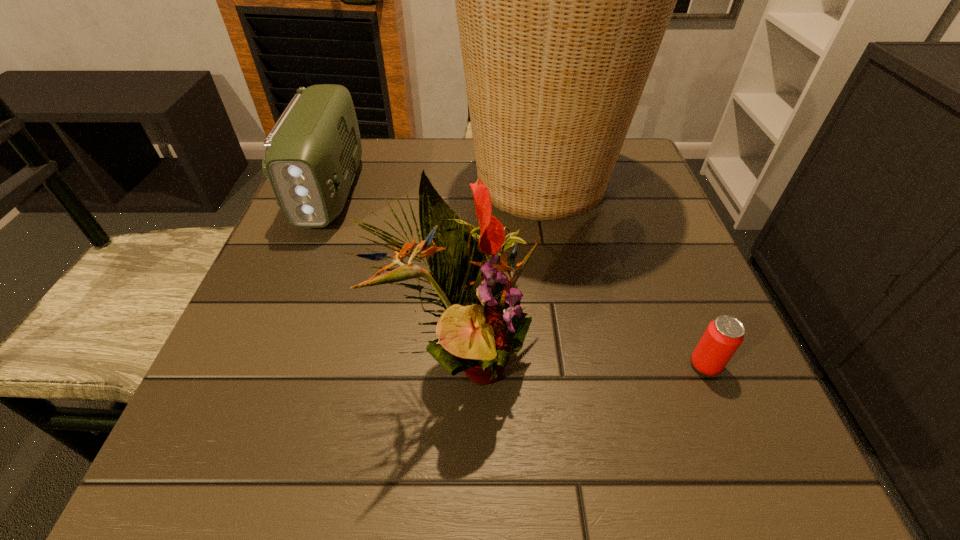
Where is `radio_receiver that is at the far edge`? The height and width of the screenshot is (540, 960). radio_receiver that is at the far edge is located at coordinates (313, 151).

This screenshot has width=960, height=540. I want to click on object that is at the near edge, so click(x=483, y=323).

Find the location of a particular element. The image size is (960, 540). object present at the left edge is located at coordinates (313, 151).

You are a GUI agent. You are given a task and a screenshot of the screen. Output one action in this format:
    pyautogui.click(x=<x>, y=<y>)
    Task: Click on the basket that is at the right edge
    The image size is (960, 540).
    Given the screenshot: What is the action you would take?
    pyautogui.click(x=562, y=0)

Identify the location of beer can that is at the right edge. The height and width of the screenshot is (540, 960). (723, 336).

Find the location of `object that is at the far left corner`. object that is at the far left corner is located at coordinates (313, 151).

This screenshot has width=960, height=540. In order to click on object located at the far right corner in this screenshot , I will do `click(562, 0)`.

The image size is (960, 540). I want to click on vacant space at the far edge of the desktop, so click(448, 177).

Locate an element on the screen. free space at the near edge of the desktop is located at coordinates (545, 430).

In order to click on vacant area at the left edge in this screenshot , I will do `click(334, 230)`.